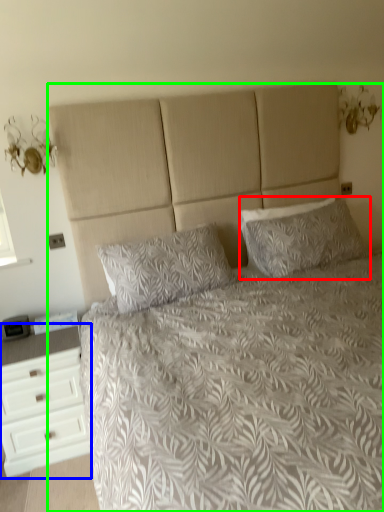
Question: Based on their relative distances, which object is nearer to pillow (highlighted by a red box)? Choose from chest of drawers (highlighted by a blue box) and bed (highlighted by a green box).

Choices:
 (A) chest of drawers
 (B) bed

Answer: (B)